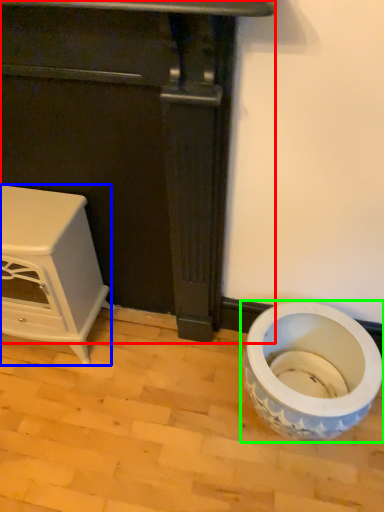
Question: Which object is positioned closest to furniture (highlighted by a red box)? Select from furniture (highlighted by a blue box) and toilet (highlighted by a green box).

Choices:
 (A) furniture
 (B) toilet

Answer: (A)